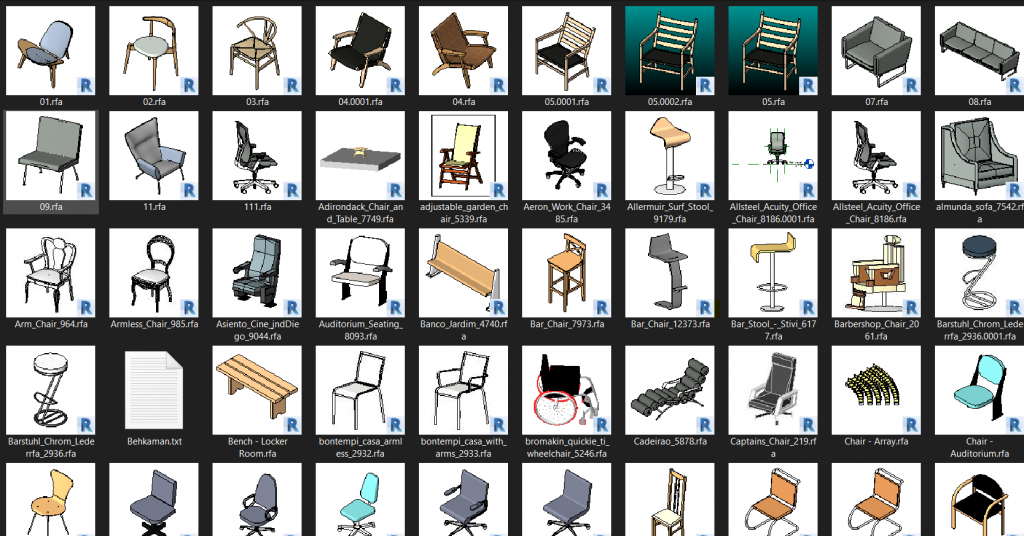
Find the location of a particular element. chairs on casters is located at coordinates (488, 518), (567, 506), (278, 518), (383, 513), (873, 153), (579, 136), (247, 150).